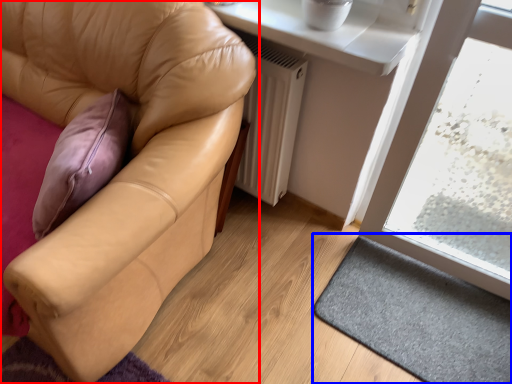
Question: Which of the following is the farthest to the observer, studio couch (highlighted by a red box) or doormat (highlighted by a blue box)?

Choices:
 (A) studio couch
 (B) doormat

Answer: (B)